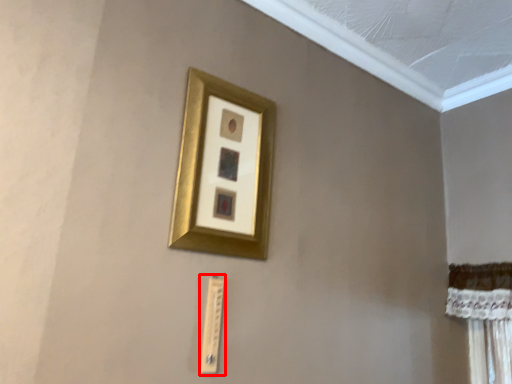
Question: In this image, where is light switch (annotated by the red box) located relative to picture frame?

Choices:
 (A) right
 (B) left

Answer: (B)